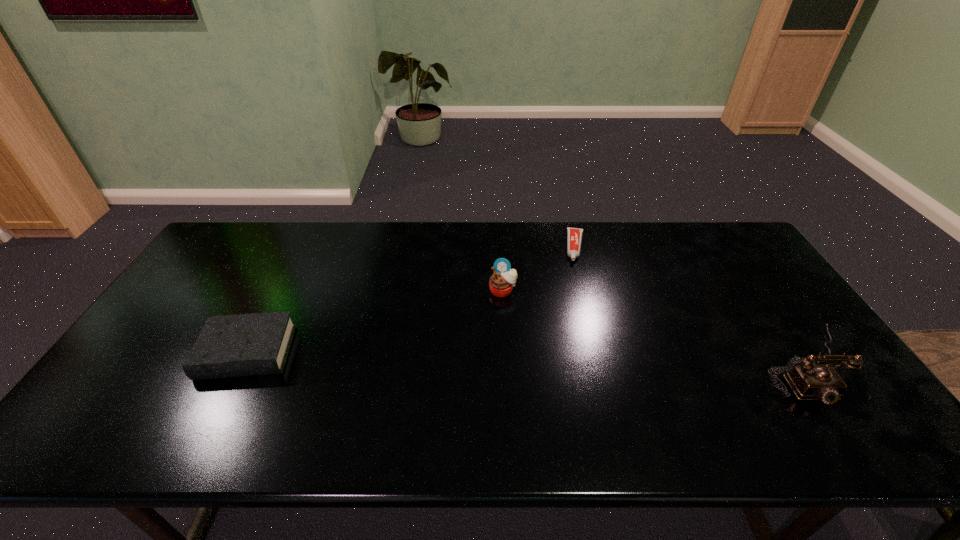
Where is `free space on the desktop that is between the third tallest object and the rightmost object and is positioned at the nozzle of the farthest object`? The width and height of the screenshot is (960, 540). free space on the desktop that is between the third tallest object and the rightmost object and is positioned at the nozzle of the farthest object is located at coordinates (568, 360).

The height and width of the screenshot is (540, 960). I want to click on free space on the desktop that is between the leftmost object and the telephone and is positioned on the front-facing side of the second farthest object, so click(501, 358).